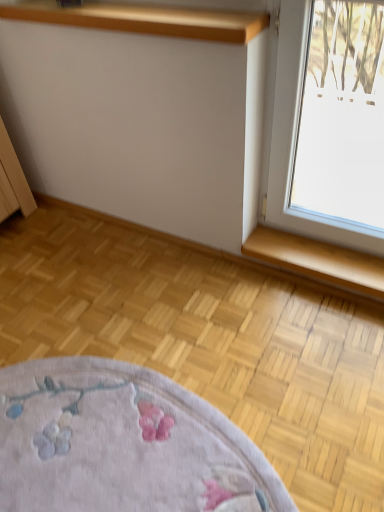
Question: From the image's perspective, is wooden shelf at upper center located above or below wooden at lower right?

Choices:
 (A) below
 (B) above

Answer: (B)

Question: Looking at the image, does wooden shelf at upper center seem bigger or smaller compared to wooden at lower right?

Choices:
 (A) big
 (B) small

Answer: (A)

Question: Looking at their shapes, would you say wooden shelf at upper center is wider or thinner than wooden at lower right?

Choices:
 (A) thin
 (B) wide

Answer: (B)

Question: Considering their positions, is wooden at lower right located in front of or behind wooden shelf at upper center?

Choices:
 (A) behind
 (B) front

Answer: (A)

Question: Choose the correct answer: Is wooden at lower right inside wooden shelf at upper center or outside it?

Choices:
 (A) outside
 (B) inside

Answer: (A)

Question: From the image's perspective, is wooden at lower right located above or below wooden shelf at upper center?

Choices:
 (A) above
 (B) below

Answer: (B)

Question: From a real-world perspective, relative to wooden shelf at upper center, is wooden at lower right vertically above or below?

Choices:
 (A) below
 (B) above

Answer: (A)